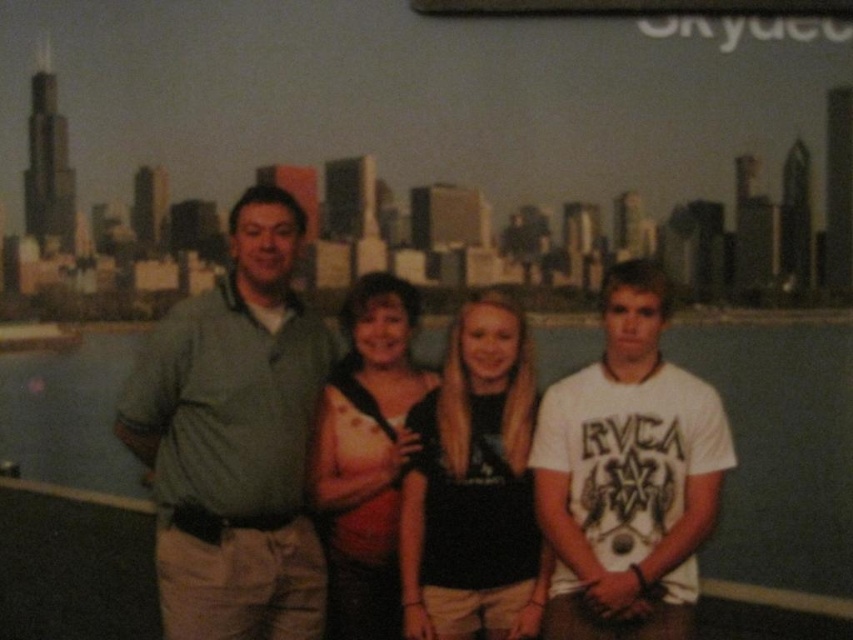
Question: Which point is closer to the camera?

Choices:
 (A) tap(537, 464)
 (B) tap(444, 432)
 (C) tap(286, 436)
 (D) tap(412, 300)

Answer: (A)

Question: Which object is closer to the camera taking this photo?

Choices:
 (A) black matte shirt at center
 (B) satin black dress at center

Answer: (A)

Question: Does matte green shirt at center come behind white cotton t-shirt at center?

Choices:
 (A) no
 (B) yes

Answer: (B)

Question: Which point appears farthest from the camera in this image?

Choices:
 (A) (432, 420)
 (B) (550, 532)
 (C) (498, 490)
 (D) (125, 419)

Answer: (A)

Question: Does green cotton polo shirt at left have a lesser width compared to white cotton t-shirt at center?

Choices:
 (A) yes
 (B) no

Answer: (B)

Question: Can you confirm if matte green shirt at center is wider than satin black dress at center?

Choices:
 (A) yes
 (B) no

Answer: (A)